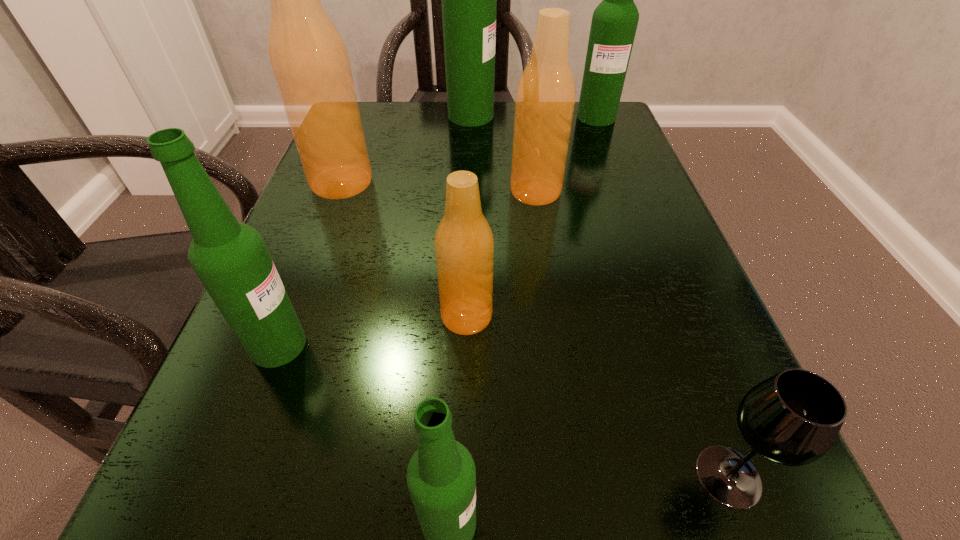
Locate an element on the screen. the smallest tan beer bottle is located at coordinates (464, 244).

Where is `gray wineglass`? Image resolution: width=960 pixels, height=540 pixels. gray wineglass is located at coordinates [793, 418].

The image size is (960, 540). In order to click on wineglass in this screenshot , I will do click(793, 418).

The width and height of the screenshot is (960, 540). Find the location of `free space located on the label of the biggest green beer bottle`. free space located on the label of the biggest green beer bottle is located at coordinates (545, 116).

At what (x,y) coordinates should I click in order to perform the action: click on free space located on the label of the rightmost green beer bottle. Please return your answer as a coordinate pair (x, y). Looking at the image, I should click on (635, 214).

This screenshot has height=540, width=960. I want to click on free spot located 0.220m on the front of the leftmost tan beer bottle, so click(x=300, y=291).

Find the location of `vacant space located 0.170m on the right of the rightmost tan beer bottle`. vacant space located 0.170m on the right of the rightmost tan beer bottle is located at coordinates (653, 192).

The image size is (960, 540). I want to click on free space located on the label of the second nearest green beer bottle, so click(x=526, y=345).

At what (x,y) coordinates should I click in order to perform the action: click on free location located 0.200m on the front of the second tan beer bottle from left to right. Please return your answer as a coordinate pair (x, y). Looking at the image, I should click on (462, 496).

This screenshot has height=540, width=960. Find the location of `vacant space situated 0.070m on the back of the wineglass`. vacant space situated 0.070m on the back of the wineglass is located at coordinates (695, 388).